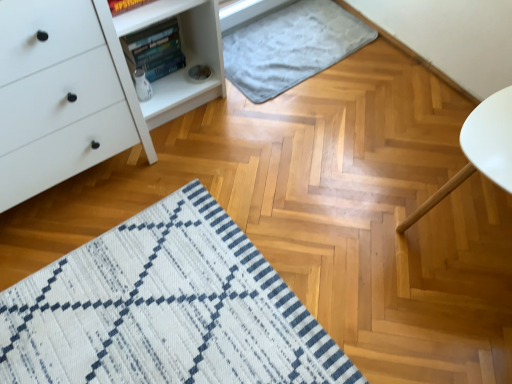
At what (x,y) coordinates should I click in order to perform the action: click on free spot to the right of white matte chest of drawers at left. Please return your answer as a coordinate pair (x, y). The width and height of the screenshot is (512, 384). Looking at the image, I should click on (193, 181).